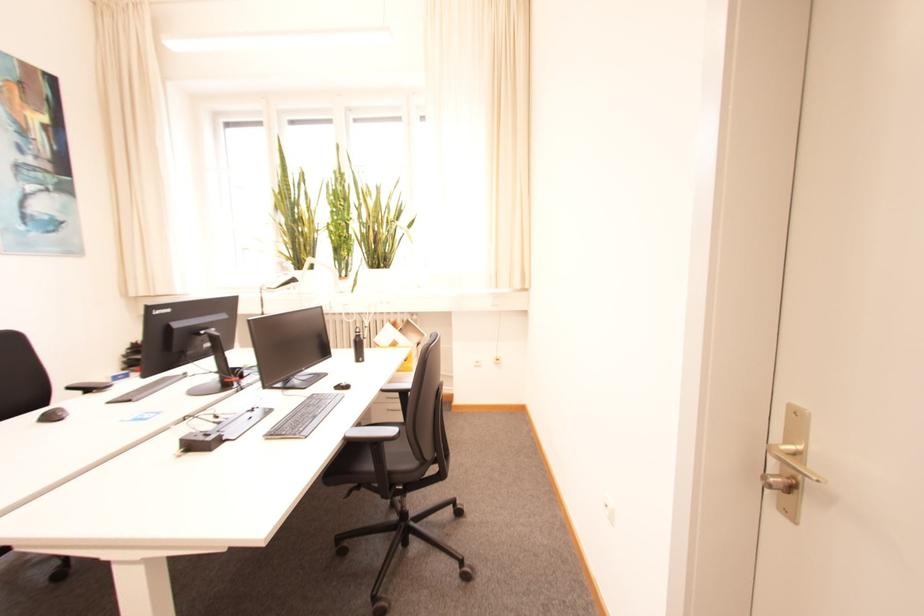
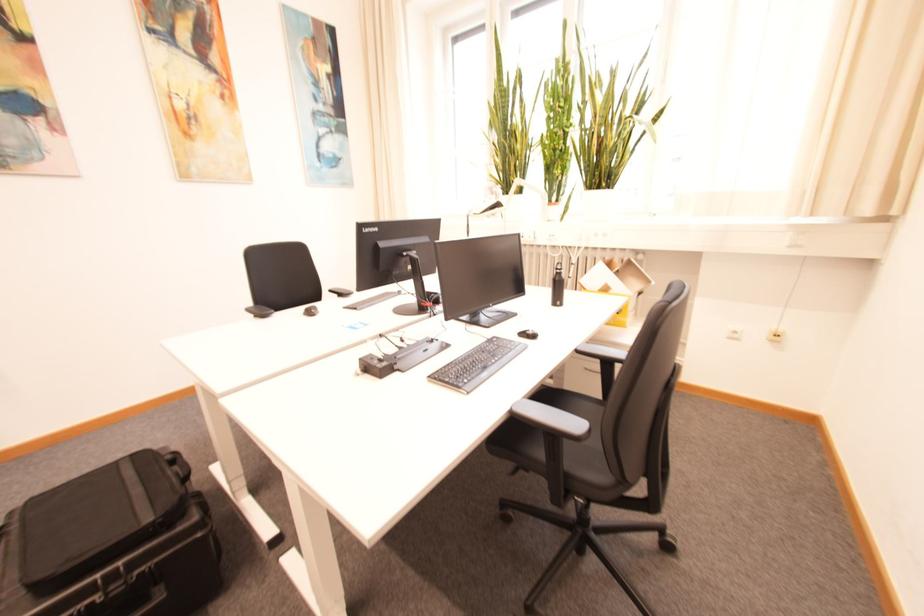
Question: The camera is either moving clockwise (left) or counter-clockwise (right) around the object. The first image is from the beginning of the video and the second image is from the end. Is the camera moving left or right when shooting the video?

Choices:
 (A) Left
 (B) Right

Answer: (B)